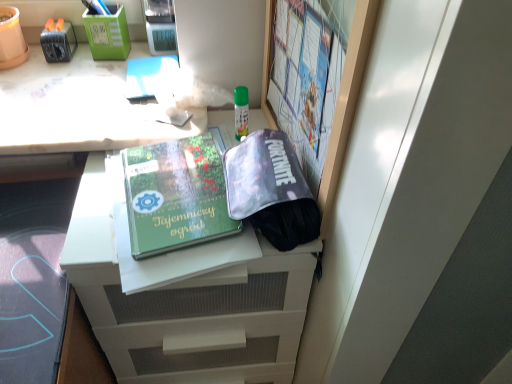
I want to click on vacant area that is in front of green plastic pen holder at upper left, which is counted as the second stationery, starting from the left, so click(84, 87).